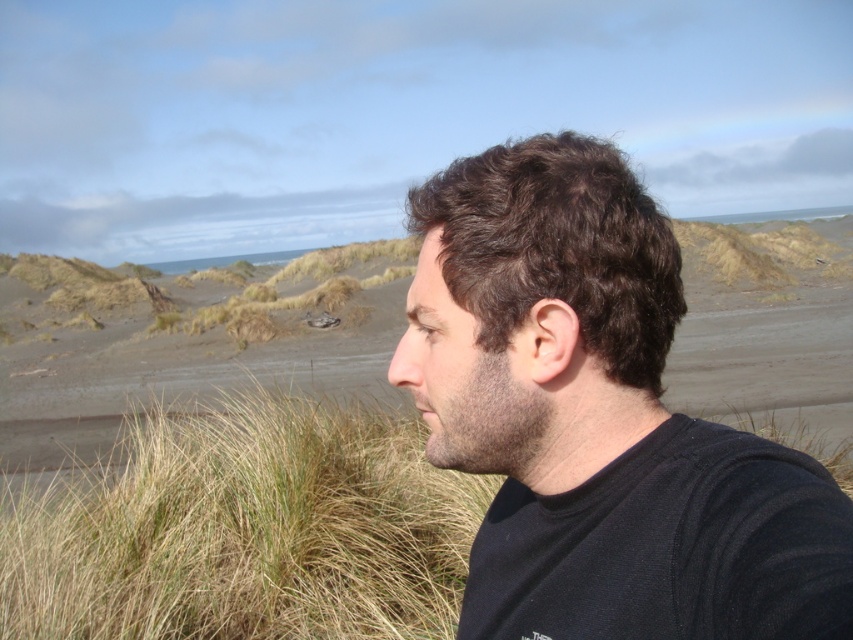
You are a photographer trying to capture the man in the scene. Since you want to focus on his clothing, which object should you adjust your camera focus on first between the black matte shirt at center and the grassy textured grass at center?

The black matte shirt at center is closer to the viewer than the grassy textured grass at center, so you should focus on the black matte shirt at center first to ensure it is in sharp focus.

Looking at this image, you are standing in a coastal area with the man in the image. You need to place a small flag at the point closer to you between point (x=682, y=413) and point (x=97, y=472). Which point should you choose?

You should choose point (x=682, y=413) because it is closer to the camera than point (x=97, y=472).

You are an artist sketching the man in the image. To ensure accuracy, you need to know the exact position of the black matte shirt at center. Can you confirm if the shirt is located at the lower half of the image?

The black matte shirt at center is located at point 0.655 on the x axis and 0.702 on the y axis. Since the y coordinate is above 0.5, it is positioned in the upper half of the image, not the lower half.